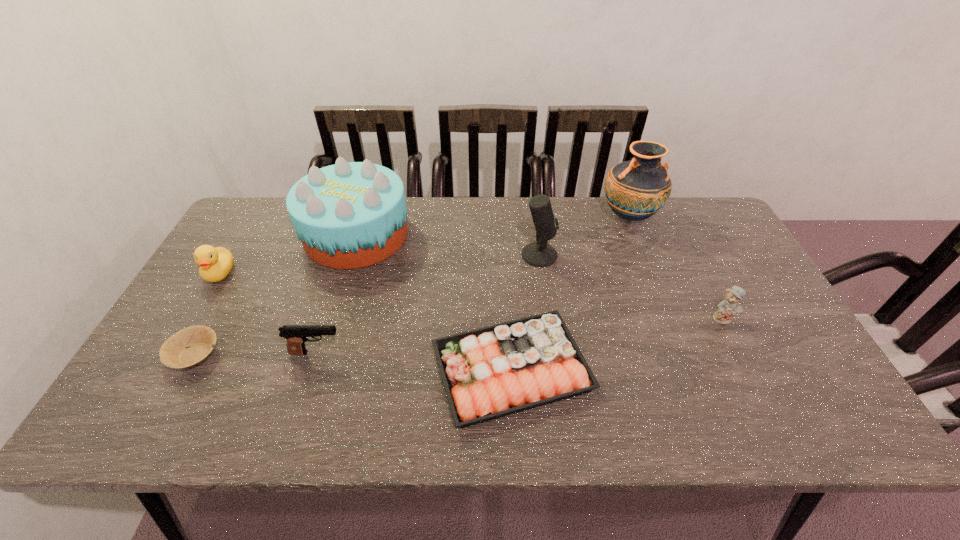
This screenshot has width=960, height=540. Identify the location of the seventh object from left to right. (635, 190).

Where is `cake`? The width and height of the screenshot is (960, 540). cake is located at coordinates (350, 215).

Where is `microphone`? The image size is (960, 540). microphone is located at coordinates (539, 254).

Where is `duckling`? The height and width of the screenshot is (540, 960). duckling is located at coordinates (215, 264).

Where is `the rightmost object`? the rightmost object is located at coordinates (729, 306).

At what (x,y) coordinates should I click in order to perform the action: click on pistol. Please return your answer as a coordinate pair (x, y). Looking at the image, I should click on click(296, 335).

The height and width of the screenshot is (540, 960). Identify the location of platter. (488, 373).

Locate an element on the screen. The width and height of the screenshot is (960, 540). bowl is located at coordinates (190, 346).

Locate an element on the screen. The image size is (960, 540). vacant space located 0.110m on the left of the pottery is located at coordinates (565, 217).

Identify the location of vacant region located on the right of the cake. This screenshot has width=960, height=540. (488, 235).